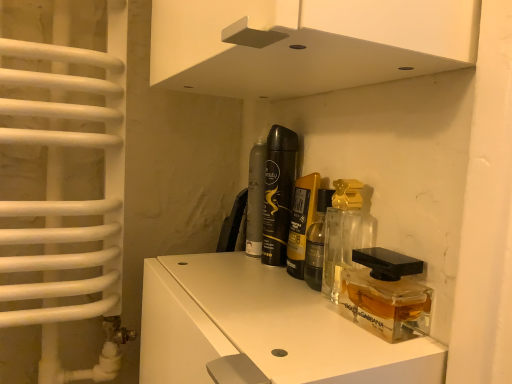
The height and width of the screenshot is (384, 512). I want to click on free space that is to the left of matte black perfume at center, the fourth perfume when ordered from front to back, so click(199, 259).